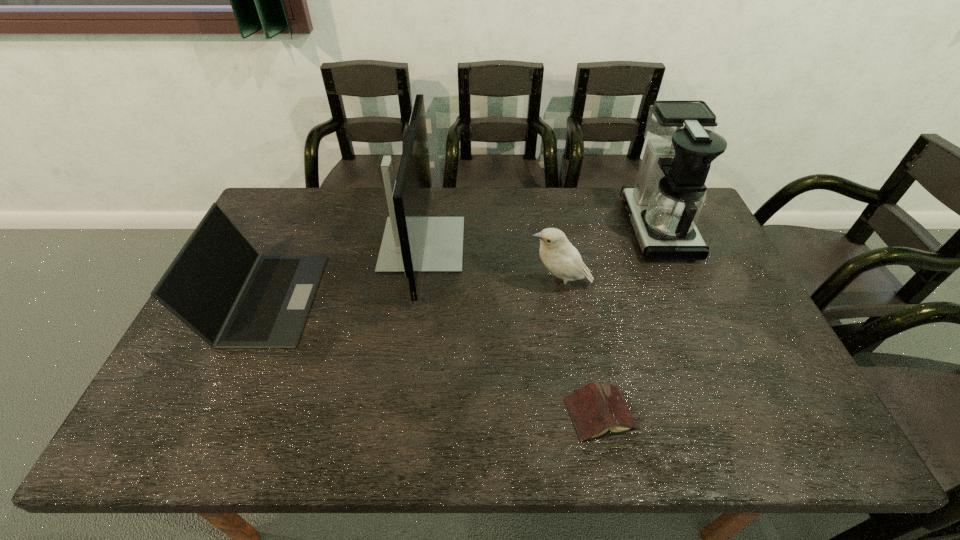
Find the location of a particular element. the second object from left to right is located at coordinates (413, 242).

What are the coordinates of `the rightmost object` in the screenshot? It's located at (664, 205).

Locate an element on the screen. The image size is (960, 540). bird is located at coordinates (562, 259).

This screenshot has height=540, width=960. In order to click on the leftmost object in this screenshot , I will do `click(218, 285)`.

Where is `book`? The width and height of the screenshot is (960, 540). book is located at coordinates (596, 408).

You are a GUI agent. You are given a task and a screenshot of the screen. Output one action in this format:
    pyautogui.click(x=<x>, y=<y>)
    Task: Click on the nearest object
    This screenshot has width=960, height=540.
    Given the screenshot: What is the action you would take?
    pyautogui.click(x=596, y=408)

Locate an element on the screen. This screenshot has width=960, height=540. vacant space situated 0.080m on the screen of the second object from left to right is located at coordinates (488, 244).

I want to click on blank space located 0.230m at the front of the rightmost object where the controls are located, so click(557, 227).

This screenshot has height=540, width=960. Identify the location of vacant space located 0.250m at the front of the rightmost object where the controls are located. (551, 227).

This screenshot has width=960, height=540. Identify the location of free location located at the front of the rightmost object where the controls are located. (540, 227).